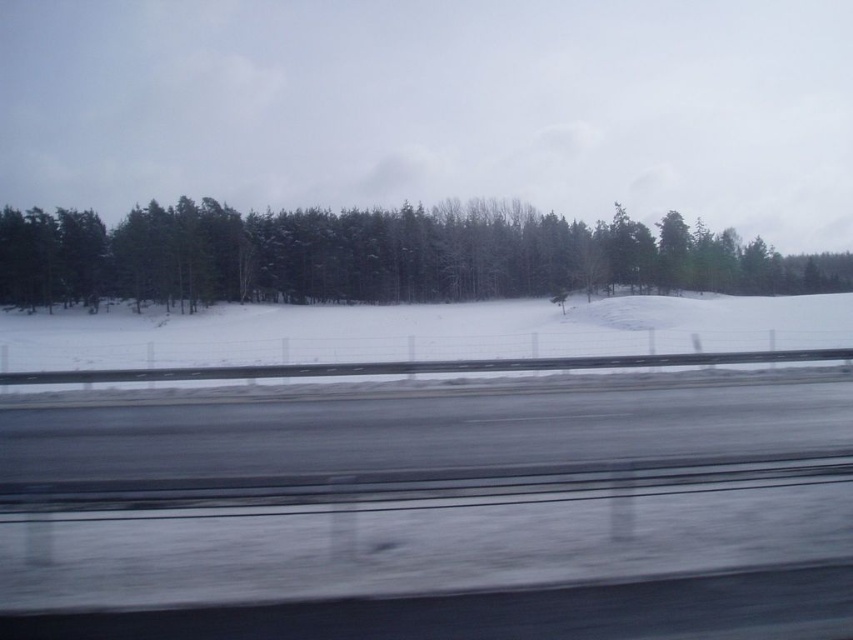
Which of these two, green matte tree at left or white powdery snow at center, stands taller?

With more height is green matte tree at left.

Is green matte tree at left to the left of white powdery snow at center from the viewer's perspective?

Incorrect, green matte tree at left is not on the left side of white powdery snow at center.

Is point (177, 246) closer to viewer compared to point (848, 340)?

No, it is behind (848, 340).

At what (x,y) coordinates should I click in order to perform the action: click on green matte tree at left. Please return your answer as a coordinate pair (x, y). The image size is (853, 640). Looking at the image, I should click on (379, 256).